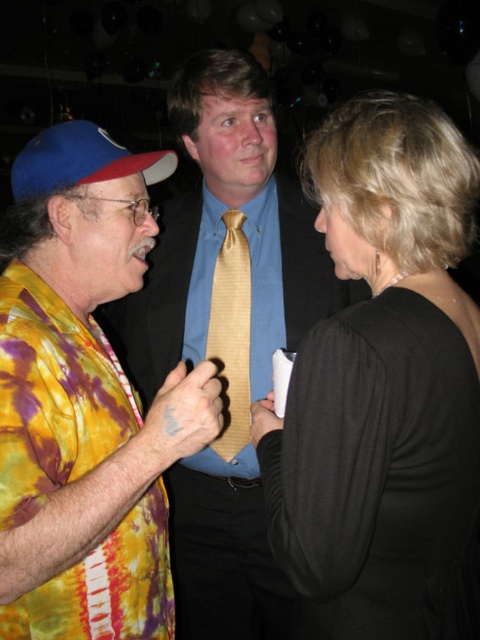
You are at a formal event and notice two items worn by the person at center. Which one is more to the right, the blue satin dress shirt at center or the gold striped tie at center?

The blue satin dress shirt at center is more to the right than the gold striped tie at center.